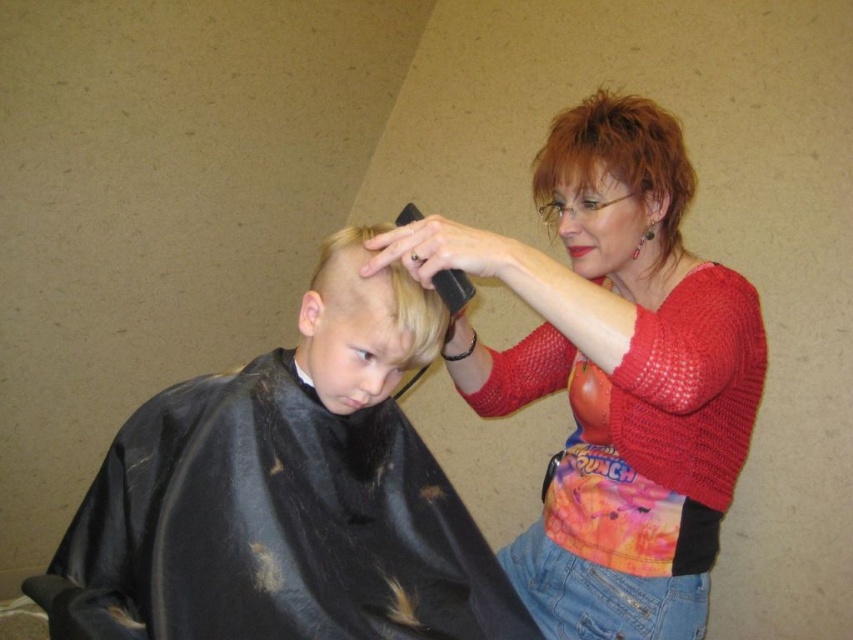
Between red knit sweater at upper right and shiny black cape at lower left, which one is positioned higher?

Positioned higher is red knit sweater at upper right.

What do you see at coordinates (612, 372) in the screenshot? I see `red knit sweater at upper right` at bounding box center [612, 372].

You are a GUI agent. You are given a task and a screenshot of the screen. Output one action in this format:
    pyautogui.click(x=<x>, y=<y>)
    Task: Click on the red knit sweater at upper right
    This screenshot has height=640, width=853.
    Given the screenshot: What is the action you would take?
    pyautogui.click(x=612, y=372)

Does shiny black cape at lower left appear over blonde hair at center?

Actually, shiny black cape at lower left is below blonde hair at center.

Locate an element on the screen. The height and width of the screenshot is (640, 853). shiny black cape at lower left is located at coordinates (296, 490).

Is red knit sweater at upper right taller than shiny red hair at upper right?

Correct, red knit sweater at upper right is much taller as shiny red hair at upper right.

Is red knit sweater at upper right thinner than shiny red hair at upper right?

No.

Find the location of a particular element. red knit sweater at upper right is located at coordinates (612, 372).